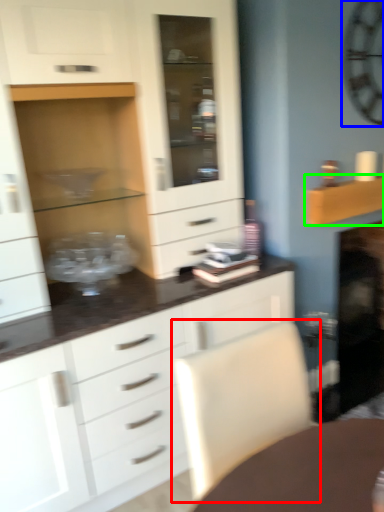
Question: Considering the real-world distances, which object is farthest from swivel chair (highlighted by a red box)? clock (highlighted by a blue box) or shelf (highlighted by a green box)?

Choices:
 (A) clock
 (B) shelf

Answer: (A)